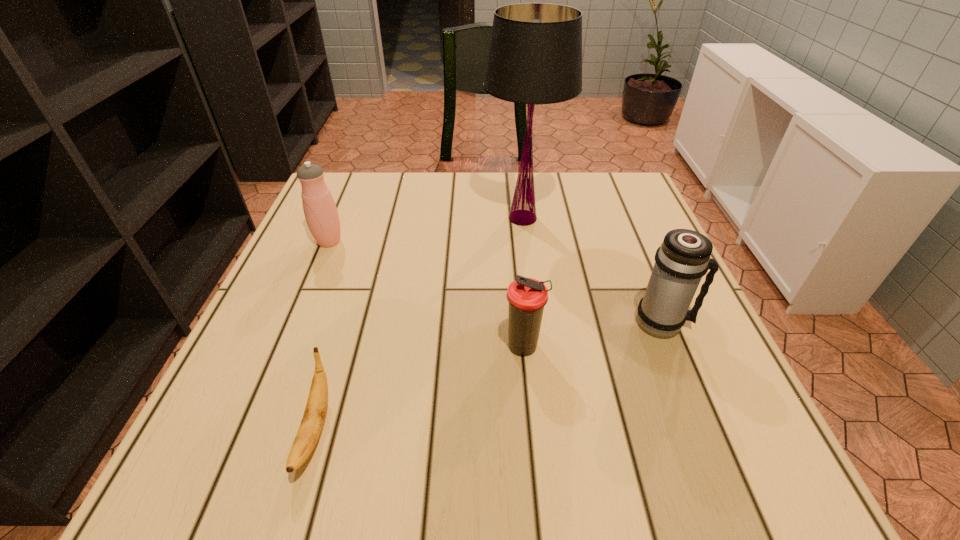
Where is `blank region between the shortest object and the rightmost object`? This screenshot has height=540, width=960. blank region between the shortest object and the rightmost object is located at coordinates (489, 376).

Identify the location of free space between the leftmost thermos bottle and the banana. This screenshot has width=960, height=540. (322, 336).

Where is `empty space that is in between the nearest object and the leftmost thermos bottle`? The width and height of the screenshot is (960, 540). empty space that is in between the nearest object and the leftmost thermos bottle is located at coordinates (322, 336).

Identify the location of empty location between the lampshade and the rightmost thermos bottle. (592, 271).

Where is `object that is the second closest to the shortest object`? This screenshot has height=540, width=960. object that is the second closest to the shortest object is located at coordinates (320, 210).

Find the location of `object that is the third closest to the shortest thermos bottle`. object that is the third closest to the shortest thermos bottle is located at coordinates (311, 425).

Identify which thermos bottle is the closest to the tallest object. Please provide its 2D coordinates. Your answer should be formatted as a tuple, i.e. [(x, y)], where the tuple contains the x and y coordinates of a point satisfying the conditions above.

[(683, 258)]

Select which thermos bottle is the second closest to the farthest thermos bottle. Please provide its 2D coordinates. Your answer should be formatted as a tuple, i.e. [(x, y)], where the tuple contains the x and y coordinates of a point satisfying the conditions above.

[(683, 258)]

The image size is (960, 540). In order to click on free space in the image that satisfies the following two spatial constraints: 1. on the front-facing side of the tallest object; 2. on the peel of the fourth object from right to left from the top in this screenshot , I will do `click(549, 430)`.